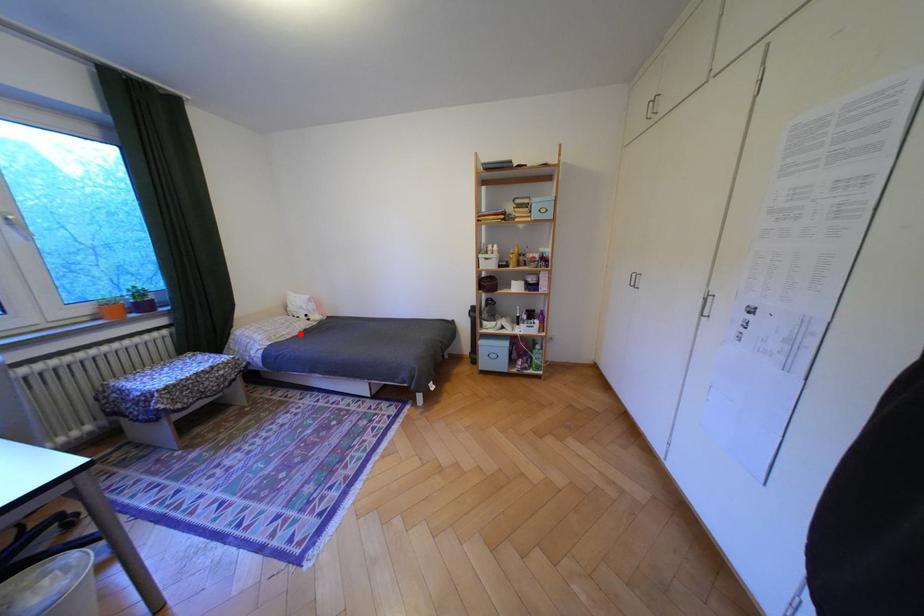
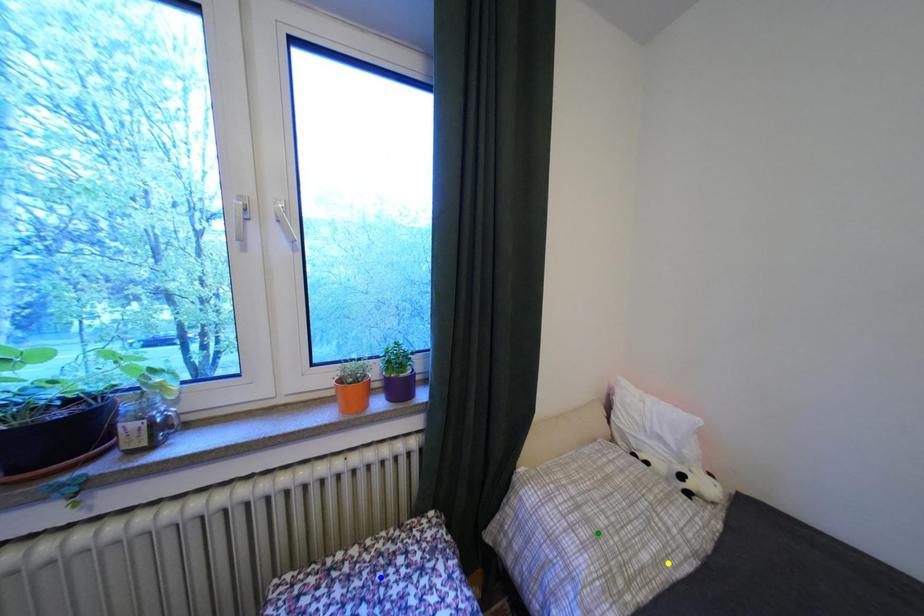
Question: I am providing you with two images of the same scene from different viewpoints. A red point is marked on the first image. You are given multiple points on the second image. Which point in image 2 is actually the same real-world point as the red point in image 1?

Choices:
 (A) yellow point
 (B) green point
 (C) blue point

Answer: (A)